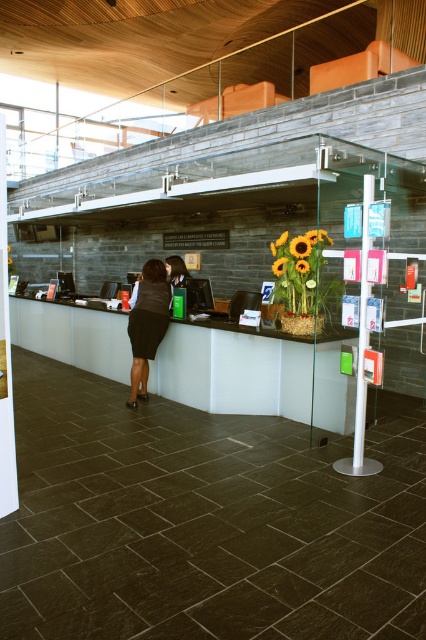
Is white glossy information desk at center positioned behind black fabric skirt at center?

Yes, white glossy information desk at center is behind black fabric skirt at center.

Who is taller, white glossy information desk at center or black fabric skirt at center?

black fabric skirt at center

Is point (62, 314) closer to camera compared to point (152, 316)?

No.

I want to click on white glossy information desk at center, so click(233, 372).